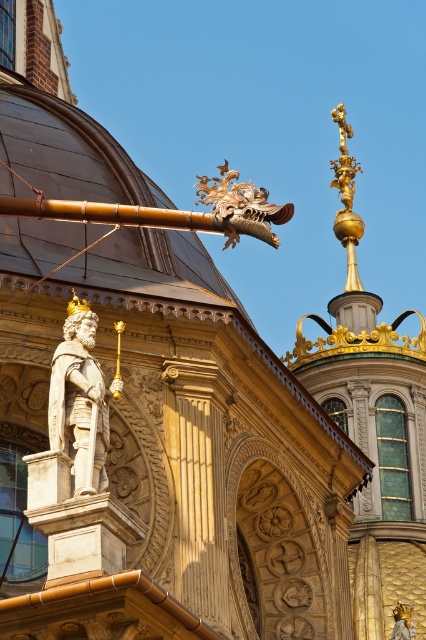
You are an art student analyzing the architectural details of the building. You notice the polished bronze statue at center and the gold textured dragon at upper center. Which object appears larger in the image?

The gold textured dragon at upper center appears larger than the polished bronze statue at center.

You are an architect examining the building and notice a statue located at point (80, 400). What material is this statue made of?

The statue at point (80, 400) is made of polished bronze.

You are an architect examining the building facade. You notice the polished bronze statue at center and the gold textured dragon at upper center. Which object occupies more horizontal space on the facade?

The gold textured dragon at upper center has a greater width than the polished bronze statue at center, so it occupies more horizontal space on the facade.